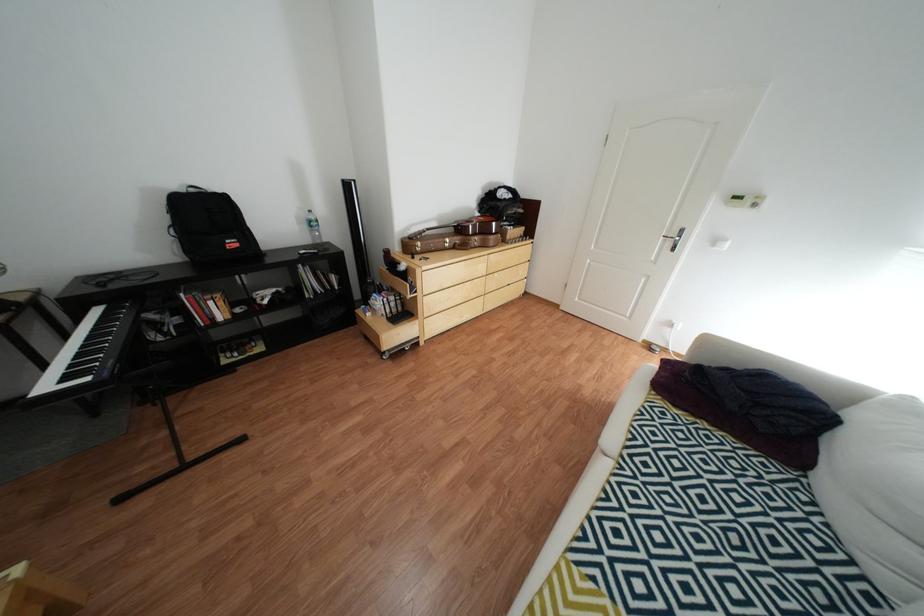
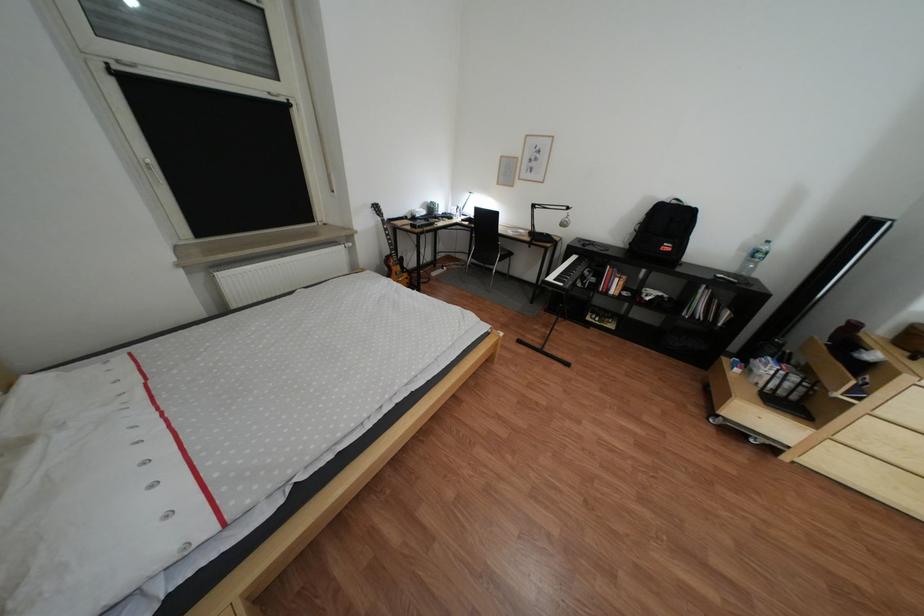
Locate, in the second image, the point that corresponds to (322,297) in the first image.

(699, 315)